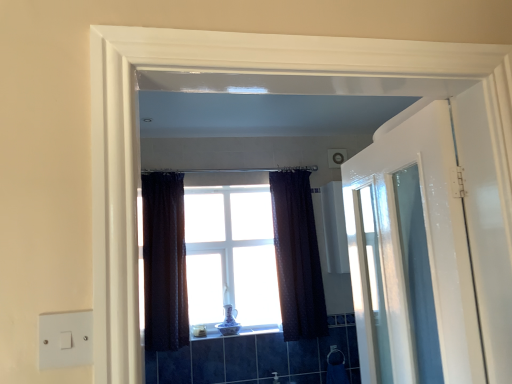
Question: From a real-world perspective, is dark textured curtain at center, which is the 1th curtain in right-to-left order, on top of white glass window at center?

Choices:
 (A) yes
 (B) no

Answer: (A)

Question: Considering the relative sizes of dark textured curtain at center, the second curtain when ordered from left to right, and white glass window at center in the image provided, is dark textured curtain at center, the second curtain when ordered from left to right, shorter than white glass window at center?

Choices:
 (A) no
 (B) yes

Answer: (A)

Question: From the image's perspective, is dark textured curtain at center, which is the 1th curtain in right-to-left order, located above white glass window at center?

Choices:
 (A) yes
 (B) no

Answer: (A)

Question: Is dark textured curtain at center, the second curtain when ordered from left to right, at the right side of white glass window at center?

Choices:
 (A) yes
 (B) no

Answer: (A)

Question: Can you confirm if dark textured curtain at center, the second curtain when ordered from left to right, is wider than white glass window at center?

Choices:
 (A) no
 (B) yes

Answer: (B)

Question: Can you confirm if dark textured curtain at center, which is the 1th curtain in right-to-left order, is bigger than white glass window at center?

Choices:
 (A) yes
 (B) no

Answer: (A)

Question: From a real-world perspective, does white glossy door at right sit lower than dark textured curtain at center, acting as the first curtain starting from the left?

Choices:
 (A) no
 (B) yes

Answer: (B)

Question: Is white glossy door at right smaller than dark textured curtain at center, acting as the first curtain starting from the left?

Choices:
 (A) yes
 (B) no

Answer: (B)

Question: From the image's perspective, is white glossy door at right beneath dark textured curtain at center, acting as the first curtain starting from the left?

Choices:
 (A) yes
 (B) no

Answer: (B)

Question: Does white glossy door at right have a greater height compared to dark textured curtain at center, acting as the first curtain starting from the left?

Choices:
 (A) no
 (B) yes

Answer: (A)

Question: Does white glossy door at right lie in front of dark textured curtain at center, placed as the 2th curtain when sorted from right to left?

Choices:
 (A) no
 (B) yes

Answer: (B)

Question: Is white glossy door at right looking in the opposite direction of dark textured curtain at center, acting as the first curtain starting from the left?

Choices:
 (A) yes
 (B) no

Answer: (B)

Question: Does dark textured curtain at center, acting as the first curtain starting from the left, appear on the left side of satin nickel faucet at lower center?

Choices:
 (A) yes
 (B) no

Answer: (A)